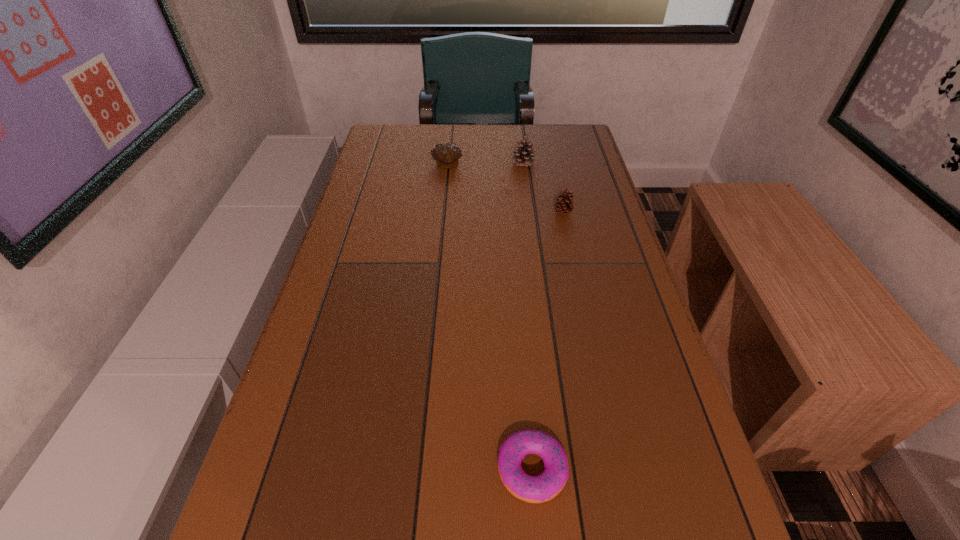
Locate an element on the screen. vacant space that satisfies the following two spatial constraints: 1. on the front side of the muffin; 2. on the right side of the third farthest object is located at coordinates click(443, 213).